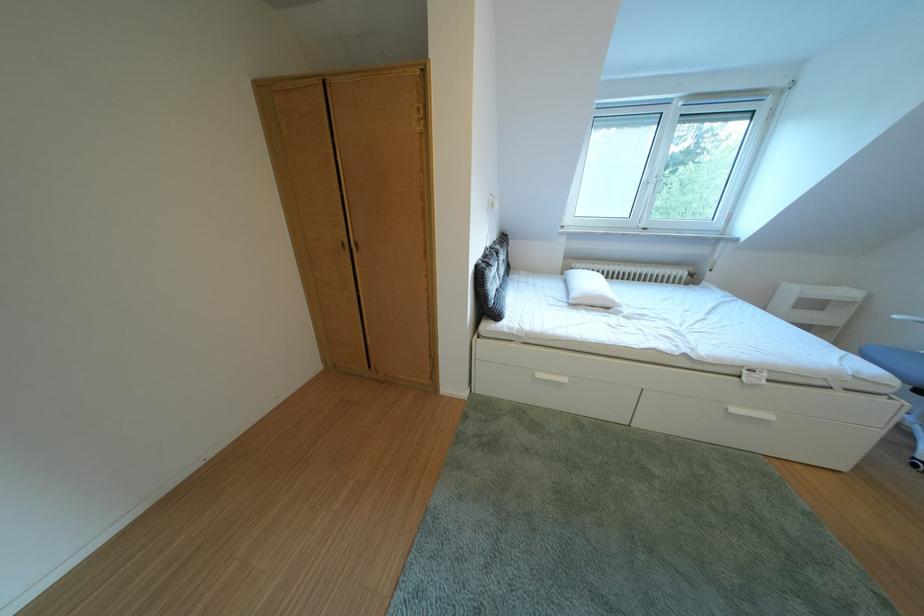
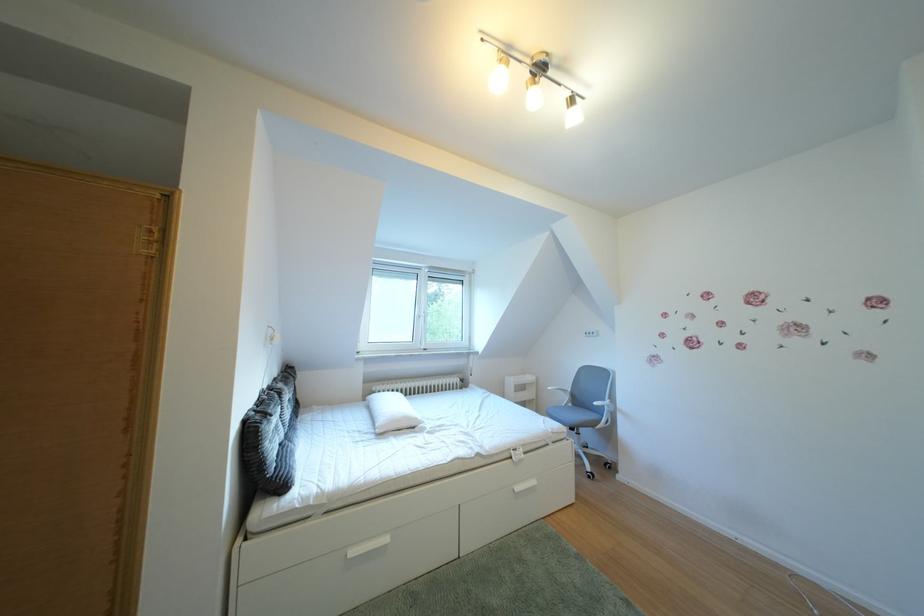
Looking at this image, how did the camera likely rotate?

The rotation direction of the camera is right-up.